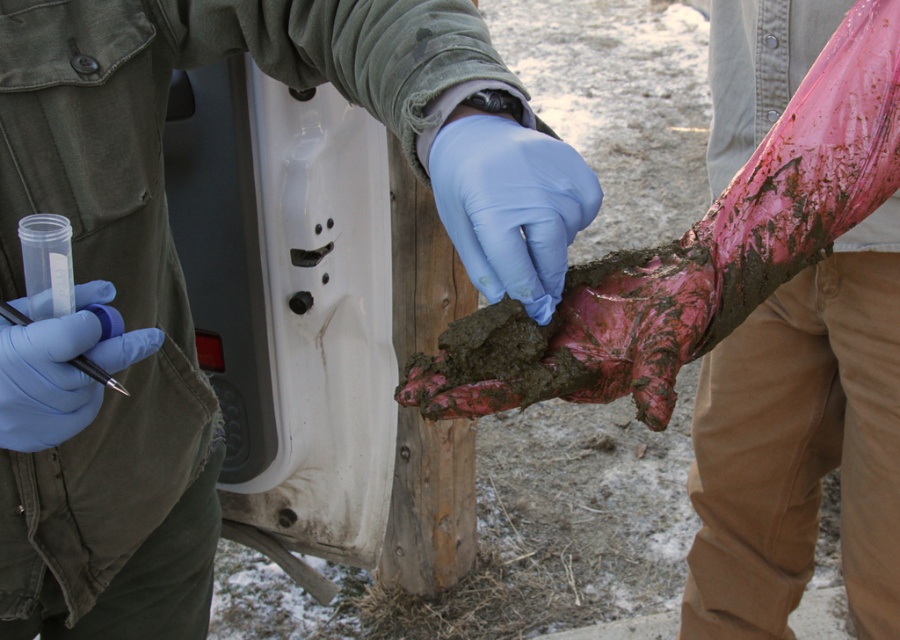
Question: From the image, what is the correct spatial relationship of blue latex glove at center in relation to blue rubber glove at lower left?

Choices:
 (A) right
 (B) left

Answer: (A)

Question: Which of these objects is positioned farthest from the muddy plastic bag at center?

Choices:
 (A) blue latex glove at center
 (B) muddy rubber glove at center

Answer: (A)

Question: Which point appears farthest from the camera in this image?

Choices:
 (A) (27, 92)
 (B) (57, 355)

Answer: (A)

Question: Can you confirm if muddy rubber glove at center is positioned above blue latex glove at center?

Choices:
 (A) no
 (B) yes

Answer: (A)

Question: Which point appears closest to the camera in this image?

Choices:
 (A) (585, 163)
 (B) (788, 294)
 (C) (239, 8)
 (D) (47, 410)

Answer: (D)

Question: Is muddy plastic bag at center above blue latex glove at center?

Choices:
 (A) no
 (B) yes

Answer: (A)